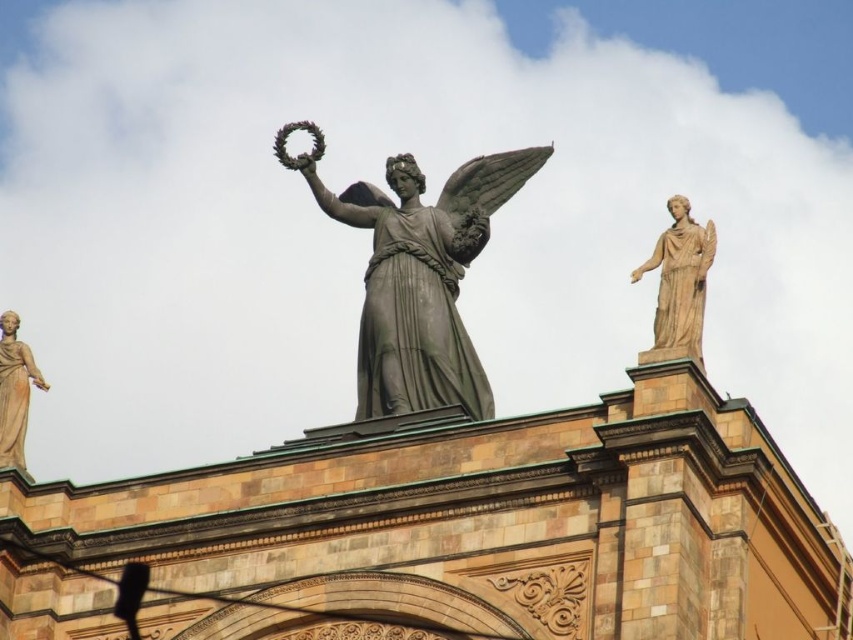
Looking at the classical building structure, where is the matte gray statue at center in relation to the beige marble statue at upper right?

The matte gray statue at center is located to the left of the beige marble statue at upper right.

You are an architect examining the building from the ground. You notice two points on the structure labeled as point (474, 396) and point (680, 246). Which point is closer to your current position?

Point (474, 396) is further to the camera than point (680, 246), so the point (680, 246) is closer to your current position.

You are an architect assessing the symmetry of the building. You notice two statues on the roofline, the beige marble statue at upper right and the matte beige statue at left. Which statue has a smaller width?

The beige marble statue at upper right has a smaller width than the matte beige statue at left.